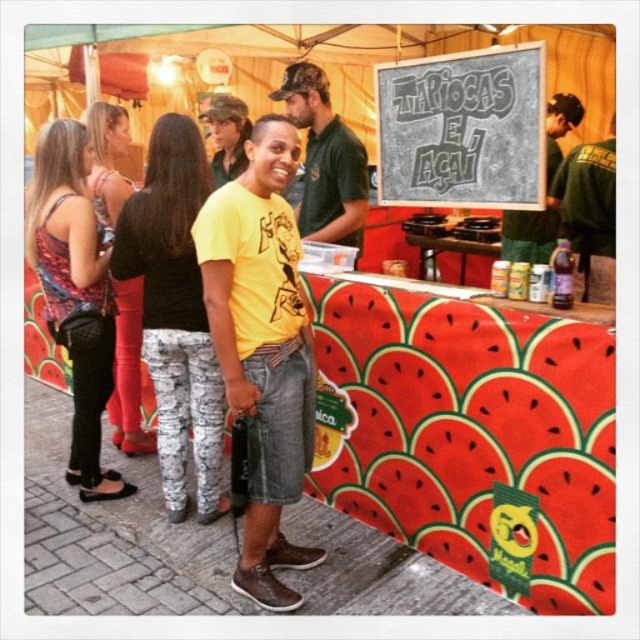
Does camouflage pants at center appear over printed fabric tank top at left?

No, camouflage pants at center is not above printed fabric tank top at left.

Is point (180, 429) closer to camera compared to point (61, 328)?

No.

Locate an element on the screen. The image size is (640, 640). camouflage pants at center is located at coordinates (176, 312).

At what (x,y) coordinates should I click in order to perform the action: click on camouflage pants at center. Please return your answer as a coordinate pair (x, y). Looking at the image, I should click on (176, 312).

Is point (256, 340) more distant than point (220, 509)?

No, it is not.

Image resolution: width=640 pixels, height=640 pixels. I want to click on yellow matte t-shirt at center, so click(262, 348).

Who is more distant from viewer, (289, 356) or (298, 205)?

Positioned behind is point (298, 205).

Which is behind, point (230, 346) or point (356, 200)?

Point (356, 200)

At what (x,y) coordinates should I click in order to perform the action: click on yellow matte t-shirt at center. Please return your answer as a coordinate pair (x, y). The width and height of the screenshot is (640, 640). Looking at the image, I should click on (262, 348).